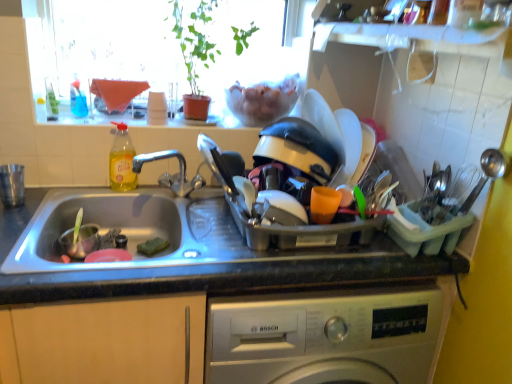
Question: Can you confirm if brushed metal cup at left, acting as the first appliance starting from the left, is positioned to the right of clear glass window sill at upper center?

Choices:
 (A) no
 (B) yes

Answer: (A)

Question: Considering the relative positions of brushed metal cup at left, acting as the first appliance starting from the left, and clear glass window sill at upper center in the image provided, is brushed metal cup at left, acting as the first appliance starting from the left, behind clear glass window sill at upper center?

Choices:
 (A) no
 (B) yes

Answer: (A)

Question: Considering the relative sizes of brushed metal cup at left, acting as the first appliance starting from the left, and clear glass window sill at upper center in the image provided, is brushed metal cup at left, acting as the first appliance starting from the left, bigger than clear glass window sill at upper center?

Choices:
 (A) yes
 (B) no

Answer: (B)

Question: From a real-world perspective, is brushed metal cup at left, acting as the first appliance starting from the left, under clear glass window sill at upper center?

Choices:
 (A) no
 (B) yes

Answer: (B)

Question: Considering the relative sizes of brushed metal cup at left, placed as the second appliance when sorted from right to left, and clear glass window sill at upper center in the image provided, is brushed metal cup at left, placed as the second appliance when sorted from right to left, wider than clear glass window sill at upper center?

Choices:
 (A) no
 (B) yes

Answer: (A)

Question: Does brushed metal cup at left, acting as the first appliance starting from the left, have a lesser height compared to clear glass window sill at upper center?

Choices:
 (A) no
 (B) yes

Answer: (A)

Question: From the image's perspective, would you say transparent glass window at upper center is positioned over clear glass window sill at upper center?

Choices:
 (A) no
 (B) yes

Answer: (B)

Question: Is transparent glass window at upper center far away from clear glass window sill at upper center?

Choices:
 (A) no
 (B) yes

Answer: (A)

Question: From the image's perspective, is transparent glass window at upper center beneath clear glass window sill at upper center?

Choices:
 (A) yes
 (B) no

Answer: (B)

Question: Considering the relative sizes of transparent glass window at upper center and clear glass window sill at upper center in the image provided, is transparent glass window at upper center bigger than clear glass window sill at upper center?

Choices:
 (A) no
 (B) yes

Answer: (B)

Question: Considering the relative positions of transparent glass window at upper center and clear glass window sill at upper center in the image provided, is transparent glass window at upper center to the right of clear glass window sill at upper center from the viewer's perspective?

Choices:
 (A) yes
 (B) no

Answer: (A)

Question: Does transparent glass window at upper center have a greater height compared to clear glass window sill at upper center?

Choices:
 (A) no
 (B) yes

Answer: (B)

Question: From a real-world perspective, is clear glass window sill at upper center below granite gray countertop at center?

Choices:
 (A) yes
 (B) no

Answer: (B)